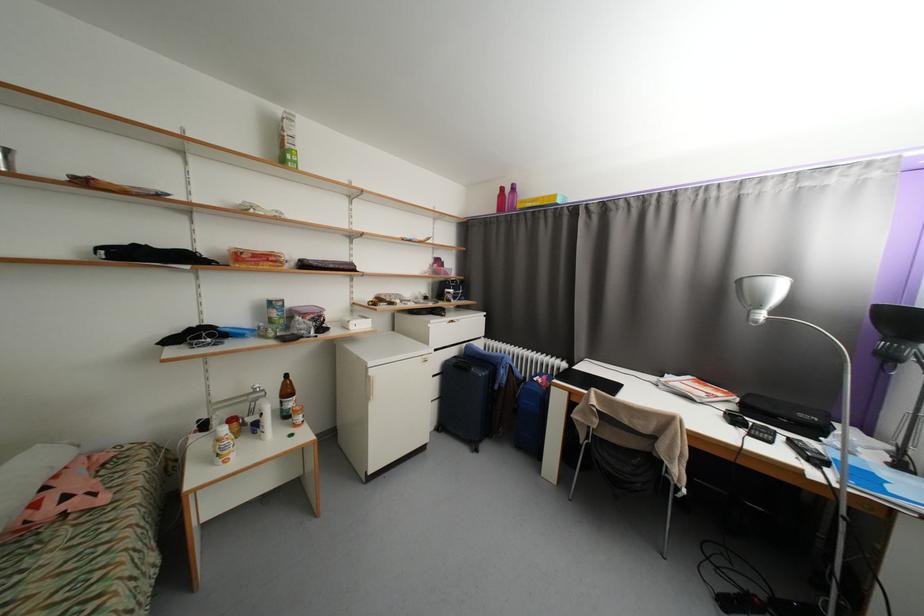
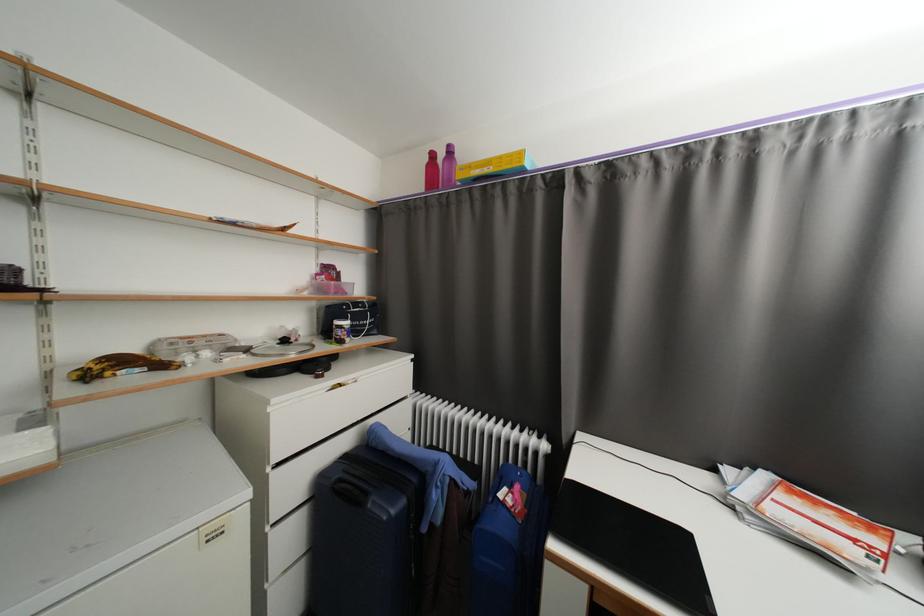
The point at (x=457, y=292) is marked in the first image. Where is the corresponding point in the second image?

(353, 323)